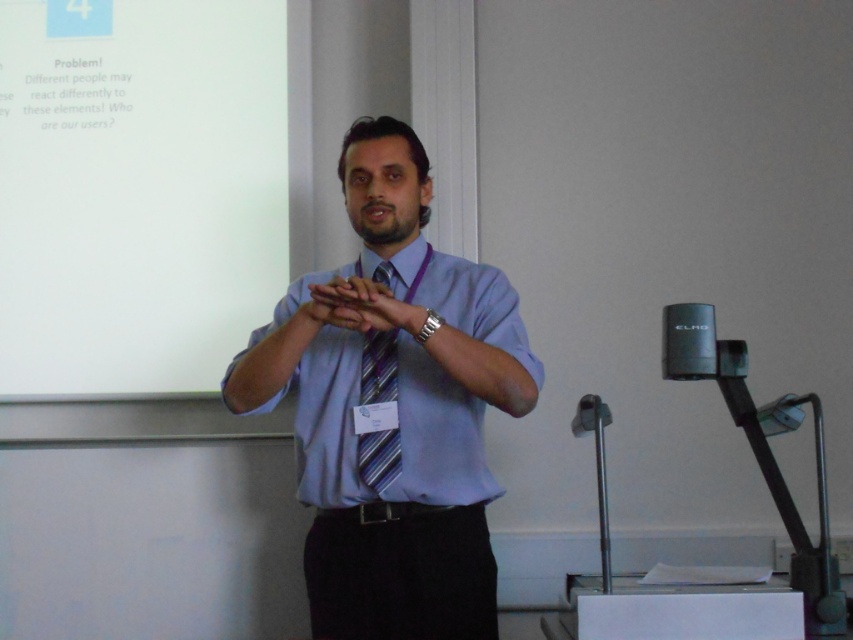
Between striped fabric tie at center and matte purple tie at center, which one has more height?

With more height is striped fabric tie at center.

Does striped fabric tie at center appear over matte purple tie at center?

Actually, striped fabric tie at center is below matte purple tie at center.

Does point (378, 451) come behind point (393, 323)?

Yes.

The width and height of the screenshot is (853, 640). What are the coordinates of `striped fabric tie at center` in the screenshot? It's located at (378, 368).

The height and width of the screenshot is (640, 853). I want to click on matte blue shirt at center, so click(x=398, y=412).

Between matte blue shirt at center and matte purple tie at center, which one has less height?

Standing shorter between the two is matte purple tie at center.

Does point (474, 342) come in front of point (369, 321)?

No, it is not.

The height and width of the screenshot is (640, 853). Find the location of `matte blue shirt at center`. matte blue shirt at center is located at coordinates (398, 412).

Where is `matte purple tie at center`? Image resolution: width=853 pixels, height=640 pixels. matte purple tie at center is located at coordinates (357, 305).

Between matte purple tie at center and black matte microphone at lower right, which one is positioned lower?

Positioned lower is black matte microphone at lower right.

This screenshot has height=640, width=853. Find the location of `matte purple tie at center`. matte purple tie at center is located at coordinates (357, 305).